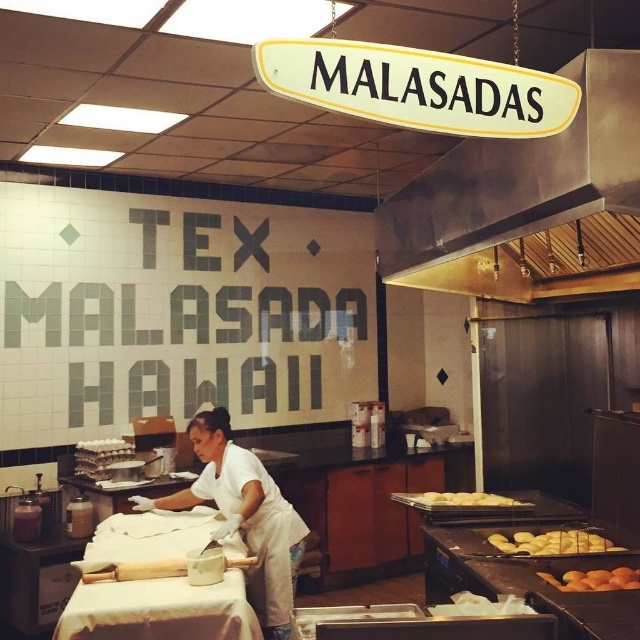
Question: Is stainless steel exhaust hood at upper center closer to the viewer compared to golden crispy malasadas at lower center?

Choices:
 (A) yes
 (B) no

Answer: (A)

Question: Is white matte uniform at center above golden brown doughnuts at lower right?

Choices:
 (A) no
 (B) yes

Answer: (A)

Question: Which of these objects is positioned farthest from the stainless steel exhaust hood at upper center?

Choices:
 (A) golden brown doughnuts at center
 (B) white matte uniform at center
 (C) golden brown doughnuts at lower right

Answer: (B)

Question: Which object appears closest to the camera in this image?

Choices:
 (A) stainless steel exhaust hood at upper center
 (B) golden brown doughnuts at lower right
 (C) white matte uniform at center

Answer: (A)

Question: Is stainless steel exhaust hood at upper center to the right of golden crispy malasadas at lower center from the viewer's perspective?

Choices:
 (A) yes
 (B) no

Answer: (B)

Question: Which point is farther from the camera taking this photo?

Choices:
 (A) (275, 620)
 (B) (593, 538)
 (C) (464, 232)

Answer: (A)